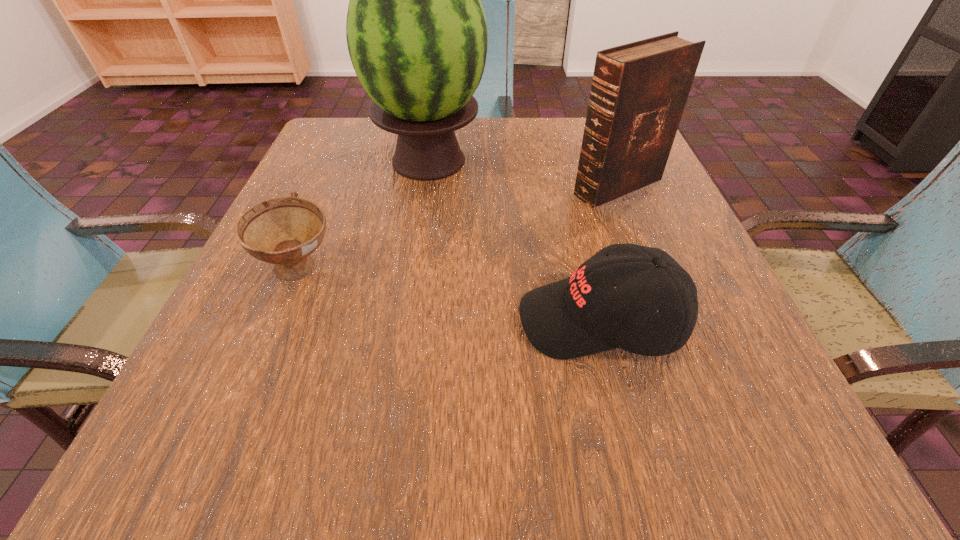
This screenshot has width=960, height=540. I want to click on vacant space at the left edge of the desktop, so click(335, 238).

Where is `vacant position at the right edge of the desktop`? Image resolution: width=960 pixels, height=540 pixels. vacant position at the right edge of the desktop is located at coordinates (663, 382).

Locate an element on the screen. free region at the far left corner of the desktop is located at coordinates (336, 119).

In the image, there is a desktop. Identify the location of vacant space at the near left corner. (259, 419).

I want to click on vacant space in between the soup bowl and the watermelon, so click(x=365, y=216).

Where is `vacant space in between the baseball cap and the tallest object`? vacant space in between the baseball cap and the tallest object is located at coordinates (515, 241).

Identify the location of free spot between the soup bowl and the Bible. This screenshot has width=960, height=540. (459, 228).

Image resolution: width=960 pixels, height=540 pixels. Find the location of `empty space between the baseball cap and the soup bowl`. empty space between the baseball cap and the soup bowl is located at coordinates point(450,296).

The image size is (960, 540). In order to click on vacant space that is in between the soup bowl and the baseball cap in this screenshot , I will do (x=450, y=296).

Image resolution: width=960 pixels, height=540 pixels. Identify the location of free space between the watermelon and the baseball cap. (515, 241).